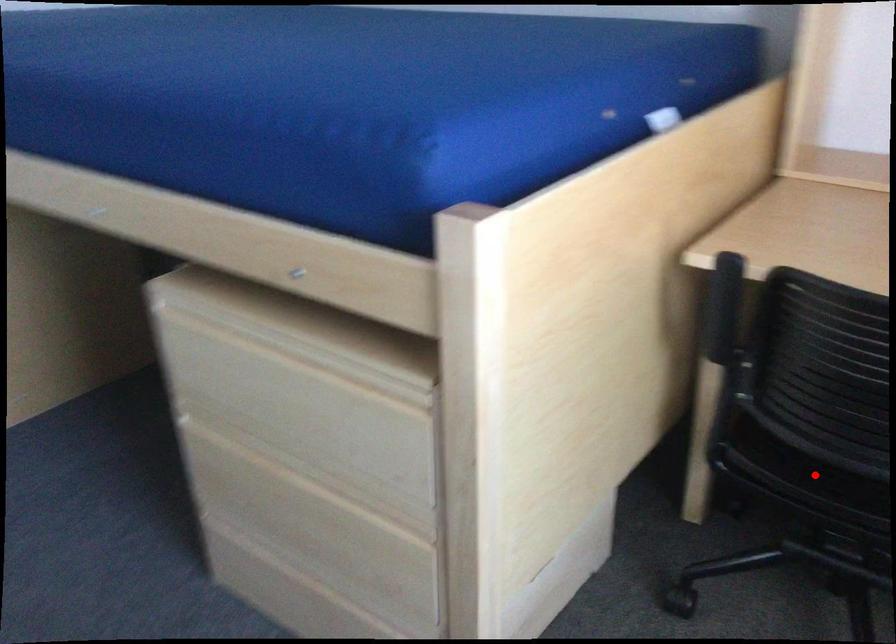
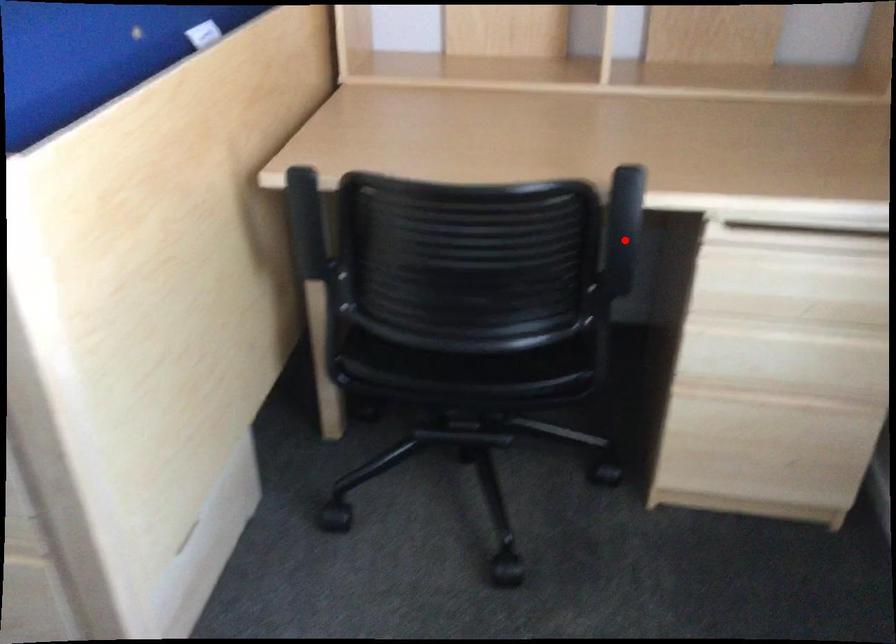
I am providing you with two images of the same scene from different viewpoints. A red point is marked on the first image and another point is marked on the second image. Does the point marked in image1 correspond to the same location as the one in image2?

No